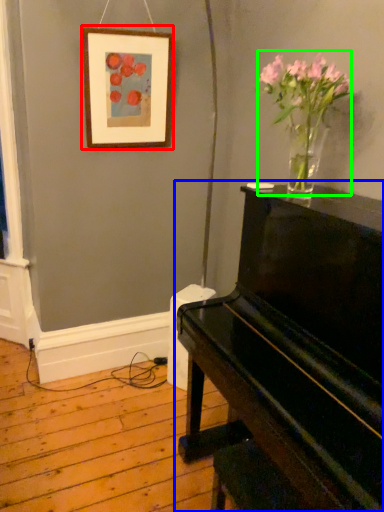
Question: Which object is the farthest from picture frame (highlighted by a red box)? Choose among these: piano (highlighted by a blue box) or floral arrangement (highlighted by a green box).

Choices:
 (A) piano
 (B) floral arrangement

Answer: (A)